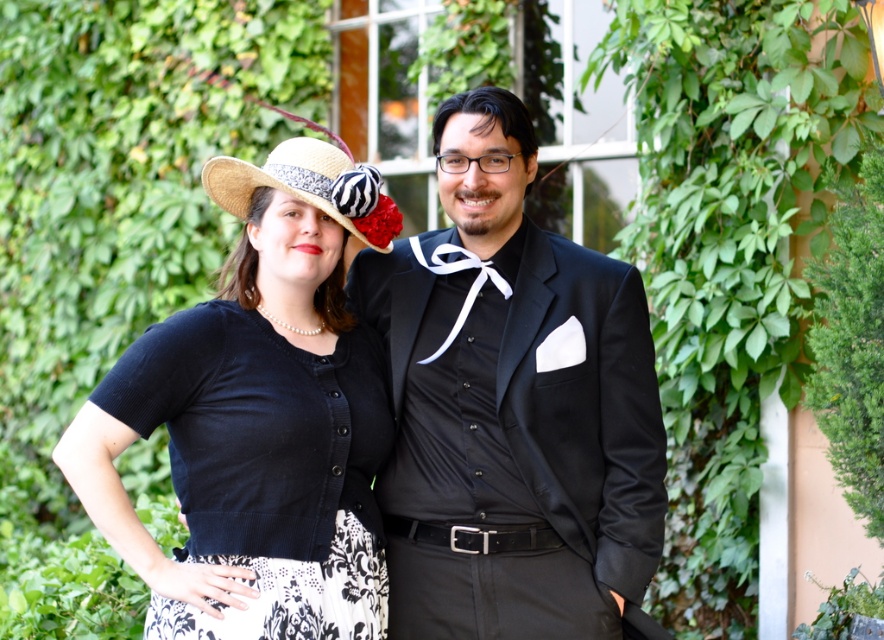
Does matte black cardigan at center appear over white satin bow tie at center?

Incorrect, matte black cardigan at center is not positioned above white satin bow tie at center.

Does matte black cardigan at center lie behind white satin bow tie at center?

No.

Between point (302, 284) and point (448, 272), which one is positioned behind?

Point (448, 272)

Identify the location of matte black cardigan at center. This screenshot has width=884, height=640. (258, 419).

Who is higher up, satin black suit at center or straw hat at center?

straw hat at center is higher up.

Is point (460, 529) closer to camera compared to point (307, 138)?

That is True.

Does point (460, 410) lie in front of point (296, 115)?

Yes, point (460, 410) is in front of point (296, 115).

Locate an element on the screen. This screenshot has width=884, height=640. satin black suit at center is located at coordinates (512, 406).

Consider the image. Is the position of satin black suit at center less distant than that of matte black cardigan at center?

No, it is not.

This screenshot has height=640, width=884. Describe the element at coordinates (512, 406) in the screenshot. I see `satin black suit at center` at that location.

Between point (465, 275) and point (382, 388), which one is positioned behind?

The point (465, 275) is more distant.

Where is `satin black suit at center`? The width and height of the screenshot is (884, 640). satin black suit at center is located at coordinates tap(512, 406).